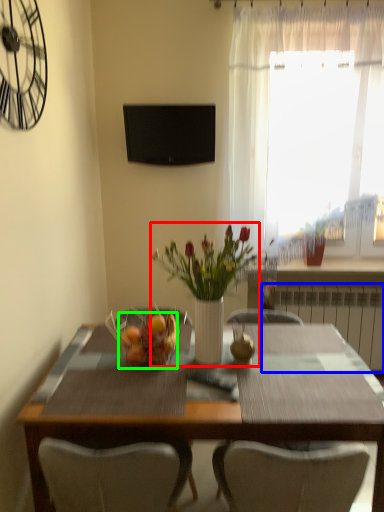
Question: Estimate the real-world distances between objects in this image. Which object is farther from floral arrangement (highlighted by a red box), radiator (highlighted by a blue box) or fruit dish (highlighted by a green box)?

Choices:
 (A) radiator
 (B) fruit dish

Answer: (A)